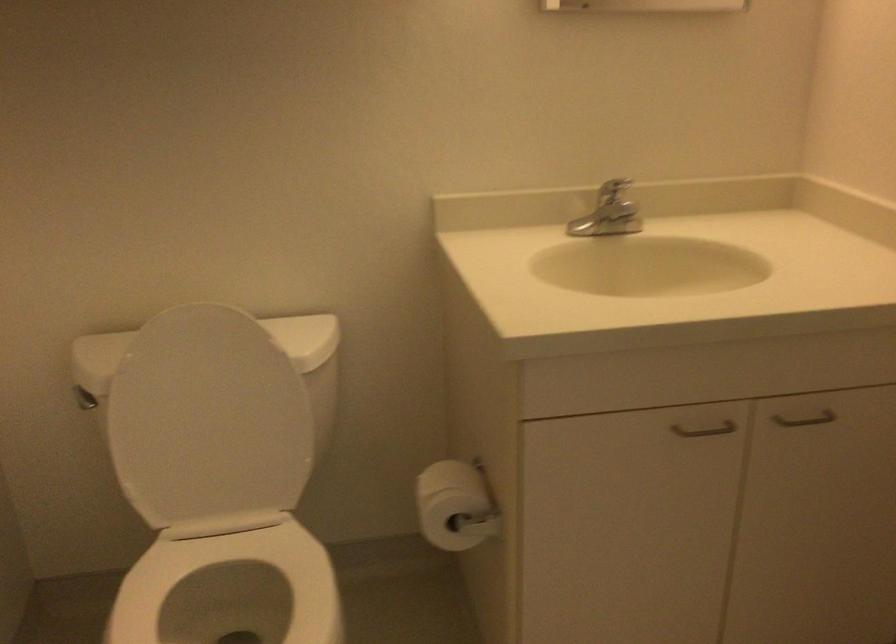
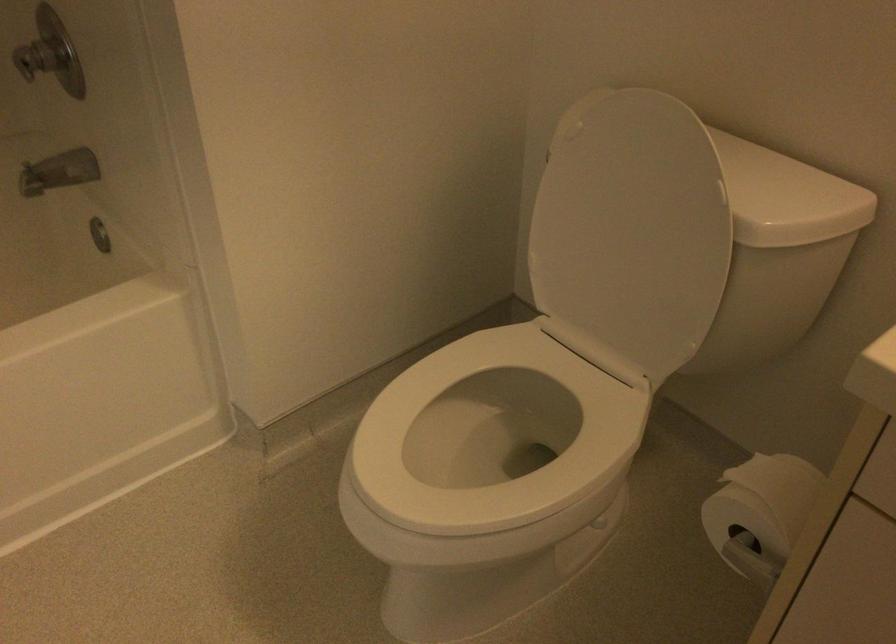
Find the pixel in the second image that matches (458,498) in the first image.

(760, 513)